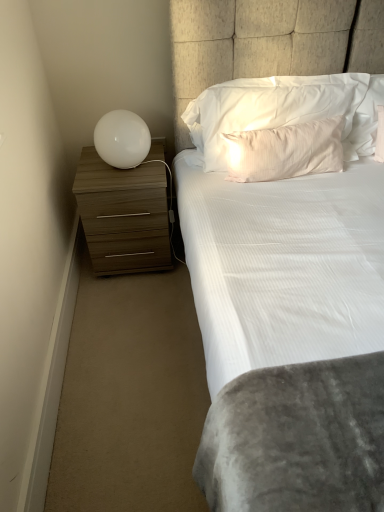
Question: From a real-world perspective, is white soft pillow at upper center, which is the 2th pillow from bottom to top, physically above white satin pillow at upper center, the 1th pillow when ordered from bottom to top?

Choices:
 (A) yes
 (B) no

Answer: (A)

Question: From a real-world perspective, is white soft pillow at upper center, marked as the first pillow in a top-to-bottom arrangement, physically below white satin pillow at upper center, the 1th pillow when ordered from bottom to top?

Choices:
 (A) no
 (B) yes

Answer: (A)

Question: From the image's perspective, is white soft pillow at upper center, marked as the first pillow in a top-to-bottom arrangement, over white satin pillow at upper center, the 1th pillow when ordered from bottom to top?

Choices:
 (A) no
 (B) yes

Answer: (B)

Question: Does white soft pillow at upper center, which is the 2th pillow from bottom to top, have a lesser height compared to white satin pillow at upper center, which is the 2th pillow from top to bottom?

Choices:
 (A) no
 (B) yes

Answer: (A)

Question: Does white soft pillow at upper center, marked as the first pillow in a top-to-bottom arrangement, have a smaller size compared to white satin pillow at upper center, the 1th pillow when ordered from bottom to top?

Choices:
 (A) no
 (B) yes

Answer: (A)

Question: Does wooden chest of drawers at left have a larger size compared to white glossy sphere at left?

Choices:
 (A) no
 (B) yes

Answer: (B)

Question: Would you say white glossy sphere at left is part of wooden chest of drawers at left's contents?

Choices:
 (A) no
 (B) yes

Answer: (A)

Question: Does wooden chest of drawers at left have a greater height compared to white glossy sphere at left?

Choices:
 (A) yes
 (B) no

Answer: (A)

Question: Considering the relative sizes of wooden chest of drawers at left and white glossy sphere at left in the image provided, is wooden chest of drawers at left thinner than white glossy sphere at left?

Choices:
 (A) yes
 (B) no

Answer: (B)

Question: Is wooden chest of drawers at left located outside white glossy sphere at left?

Choices:
 (A) no
 (B) yes

Answer: (B)

Question: Is the depth of wooden chest of drawers at left less than that of white glossy sphere at left?

Choices:
 (A) yes
 (B) no

Answer: (B)

Question: Can you confirm if white soft pillow at upper center, which is the 2th pillow from bottom to top, is shorter than white glossy sphere at left?

Choices:
 (A) yes
 (B) no

Answer: (B)